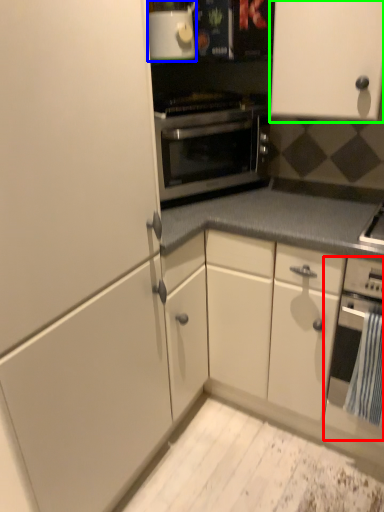
Question: Which object is the closest to the oven (highlighted by a red box)? Choose among these: appliance (highlighted by a blue box) or cabinetry (highlighted by a green box).

Choices:
 (A) appliance
 (B) cabinetry

Answer: (B)